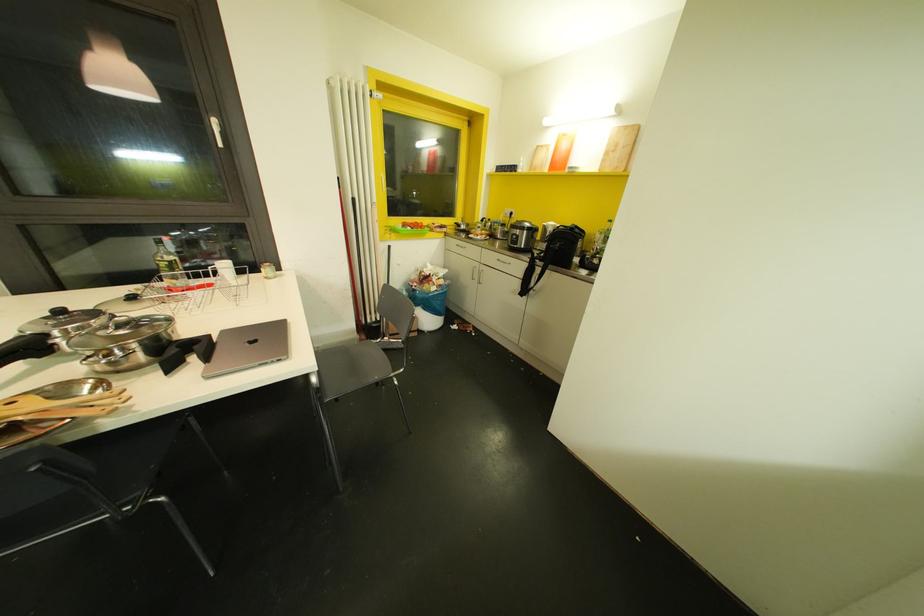
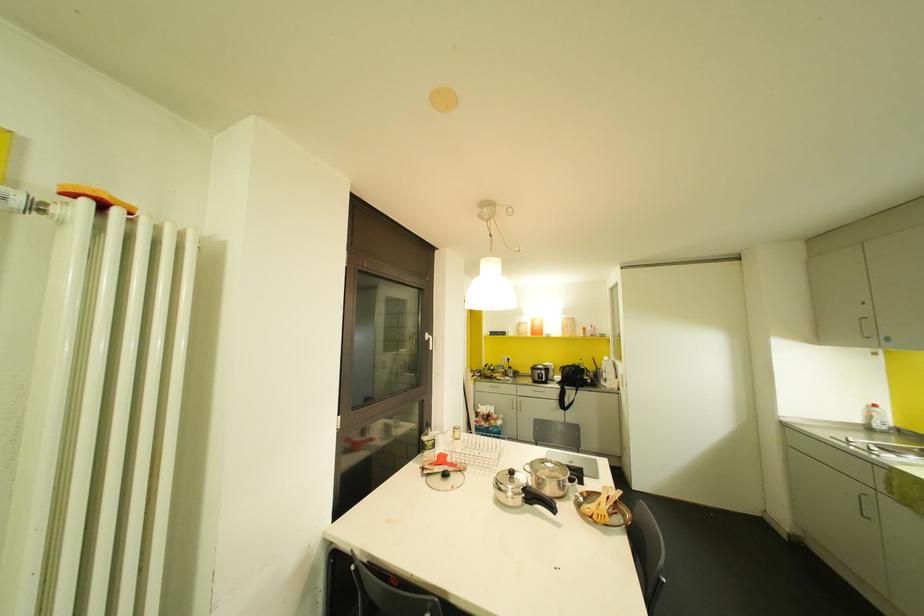
Question: I am providing you with two images of the same scene from different viewpoints. Please identify which objects are invisible in image2.

Choices:
 (A) clear plastic bottle
 (B) black pot handle
 (C) orange cylindrical container
 (D) none of these

Answer: (D)